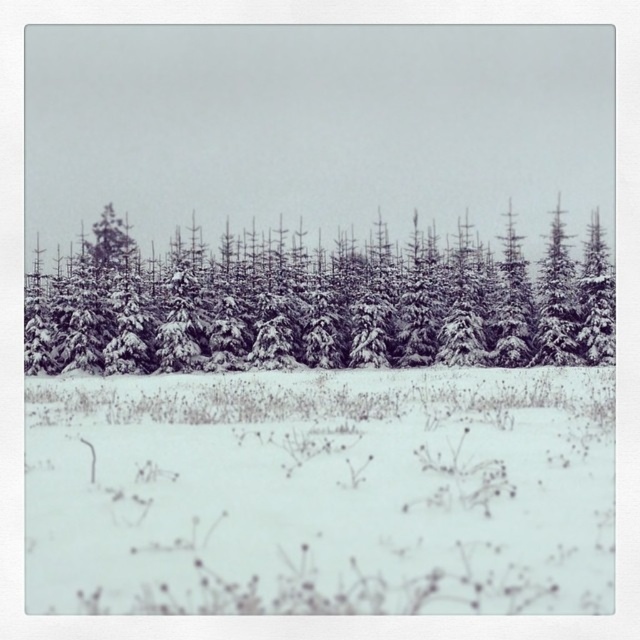
Question: Is white fluffy snow at center to the right of snow-covered evergreen trees at center from the viewer's perspective?

Choices:
 (A) no
 (B) yes

Answer: (A)

Question: Is white fluffy snow at center to the left of snow-covered evergreen trees at center from the viewer's perspective?

Choices:
 (A) no
 (B) yes

Answer: (B)

Question: Which point appears closest to the camera in this image?

Choices:
 (A) (577, 328)
 (B) (612, 442)

Answer: (B)

Question: Does white fluffy snow at center appear on the right side of snow-covered evergreen trees at center?

Choices:
 (A) no
 (B) yes

Answer: (A)